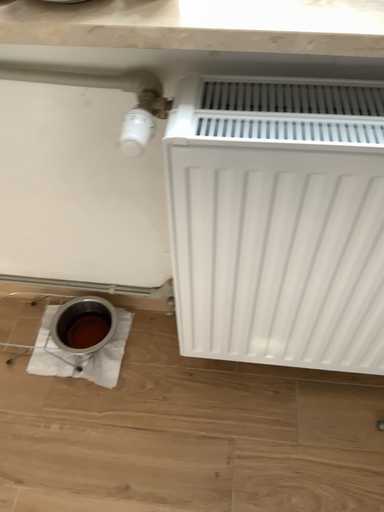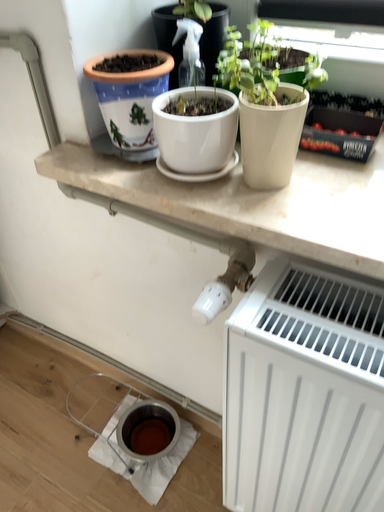
Question: Which way did the camera rotate in the video?

Choices:
 (A) rotated left
 (B) rotated right

Answer: (A)